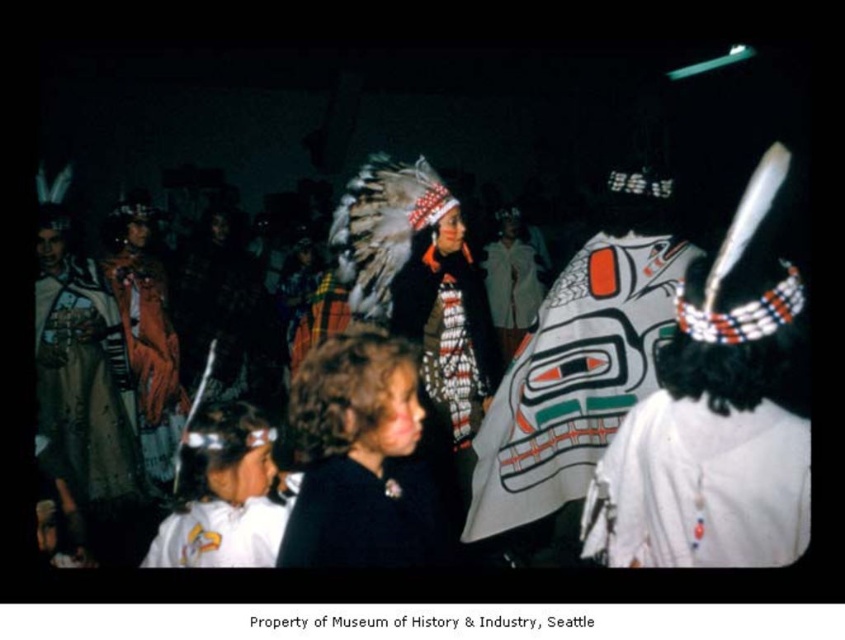
Is textured brown robe at left to the left of velvet black robe at center from the viewer's perspective?

Yes, textured brown robe at left is to the left of velvet black robe at center.

Is textured brown robe at left further to camera compared to velvet black robe at center?

Yes, it is.

Measure the distance between textured brown robe at left and camera.

The distance of textured brown robe at left from camera is 10.99 feet.

The height and width of the screenshot is (640, 845). In order to click on textured brown robe at left in this screenshot , I will do `click(83, 385)`.

Is point (324, 544) more distant than point (412, 544)?

No.

Is dark brown hair at center further to the viewer compared to velvet black robe at center?

Yes, dark brown hair at center is behind velvet black robe at center.

Which is behind, point (319, 420) or point (309, 465)?

The point (319, 420) is behind.

Locate an element on the screen. dark brown hair at center is located at coordinates (361, 460).

Does white fabric with beads at center have a larger size compared to velvet black robe at center?

Yes.

Can you confirm if white fabric with beads at center is positioned below velvet black robe at center?

No.

Who is more forward, [756,516] or [336,492]?

Point [756,516]

This screenshot has height=640, width=845. In order to click on white fabric with beads at center in this screenshot , I will do `click(701, 486)`.